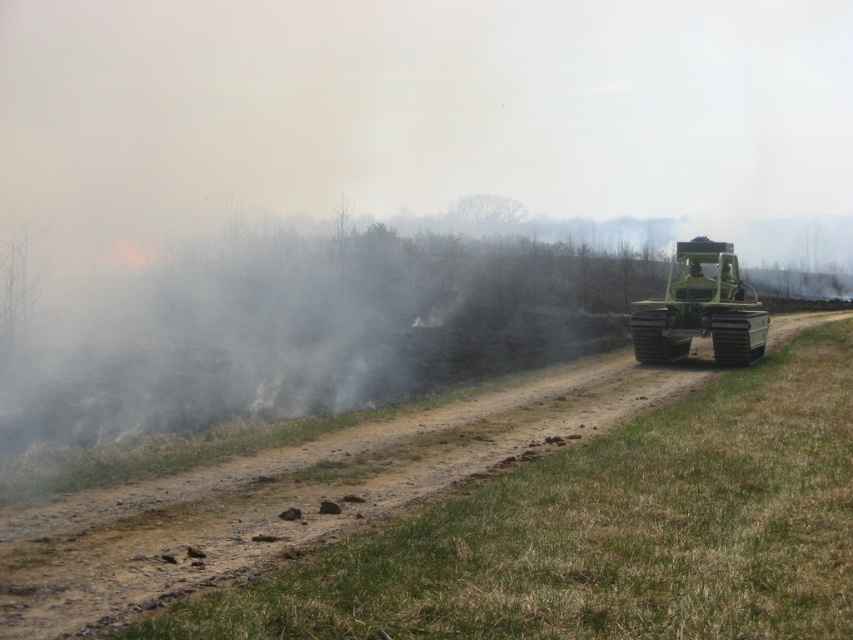
Is dull brown dirt at center wider than green rubber tractor at right?

Yes.

Between dull brown dirt at center and green rubber tractor at right, which one appears on the left side from the viewer's perspective?

dull brown dirt at center is more to the left.

Where is `dull brown dirt at center`? Image resolution: width=853 pixels, height=640 pixels. dull brown dirt at center is located at coordinates (292, 493).